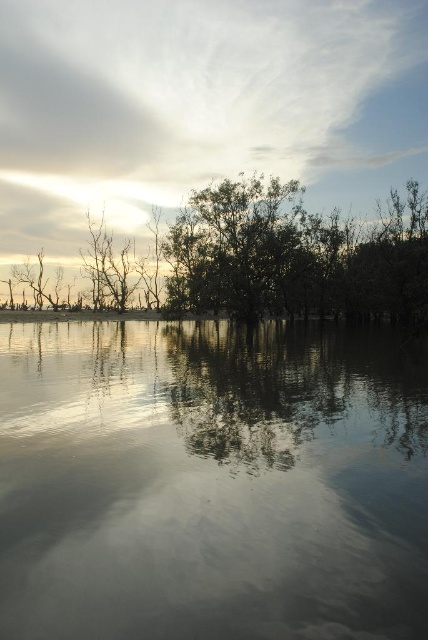
What do you see at coordinates (211, 481) in the screenshot? I see `smooth reflective water at center` at bounding box center [211, 481].

Does smooth reflective water at center appear on the left side of white fluffy cloud at upper center?

Yes, smooth reflective water at center is to the left of white fluffy cloud at upper center.

Locate an element on the screen. smooth reflective water at center is located at coordinates (211, 481).

At what (x,y) coordinates should I click in order to perform the action: click on smooth reflective water at center. Please return your answer as a coordinate pair (x, y). This screenshot has width=428, height=640. Looking at the image, I should click on (211, 481).

Consider the image. Does silvery metallic trees at upper center appear over bare branches at left?

Yes.

Who is more forward, (x=308, y=218) or (x=11, y=269)?

Point (x=308, y=218)

Is point (249, 220) positioned behind point (41, 262)?

No, (249, 220) is closer to viewer.

I want to click on silvery metallic trees at upper center, so click(x=294, y=257).

Who is more distant from viewer, (x=18, y=413) or (x=21, y=280)?

The point (x=21, y=280) is behind.

Can you confirm if smooth reflective water at center is positioned to the left of bare branches at left?

No, smooth reflective water at center is not to the left of bare branches at left.

Identify the location of smooth reflective water at center. (211, 481).

Locate an element on the screen. smooth reflective water at center is located at coordinates (211, 481).